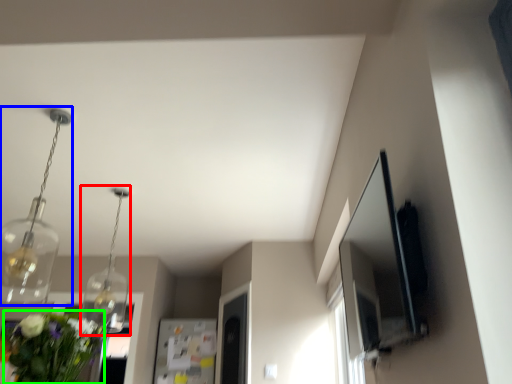
Question: Which is nearer to the light fixture (highlighted by a red box)? light fixture (highlighted by a blue box) or floral arrangement (highlighted by a green box).

Choices:
 (A) light fixture
 (B) floral arrangement

Answer: (A)